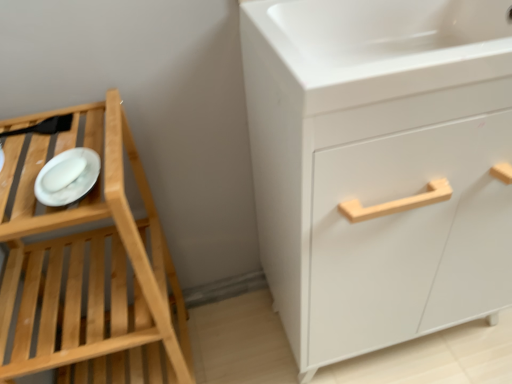
Question: Is white matte cabinet at right placed right next to white matte platter at left?

Choices:
 (A) no
 (B) yes

Answer: (A)

Question: From a real-world perspective, does white matte cabinet at right stand above white matte platter at left?

Choices:
 (A) yes
 (B) no

Answer: (B)

Question: Is white matte cabinet at right wider than white matte platter at left?

Choices:
 (A) yes
 (B) no

Answer: (A)

Question: Considering the relative sizes of white matte cabinet at right and white matte platter at left in the image provided, is white matte cabinet at right taller than white matte platter at left?

Choices:
 (A) yes
 (B) no

Answer: (A)

Question: Can you confirm if white matte cabinet at right is smaller than white matte platter at left?

Choices:
 (A) yes
 (B) no

Answer: (B)

Question: Considering their positions, is white matte cabinet at right located in front of or behind white matte platter at left?

Choices:
 (A) front
 (B) behind

Answer: (A)

Question: Visually, is white matte cabinet at right positioned to the left or to the right of white matte platter at left?

Choices:
 (A) left
 (B) right

Answer: (B)

Question: From the image's perspective, relative to white matte platter at left, is white matte cabinet at right above or below?

Choices:
 (A) below
 (B) above

Answer: (A)

Question: From their relative heights in the image, would you say white matte cabinet at right is taller or shorter than white matte platter at left?

Choices:
 (A) short
 (B) tall

Answer: (B)

Question: From a real-world perspective, is white matte cabinet at right above or below white glossy sink at upper right?

Choices:
 (A) below
 (B) above

Answer: (A)

Question: From the image's perspective, is white matte cabinet at right located above or below white glossy sink at upper right?

Choices:
 (A) above
 (B) below

Answer: (B)

Question: Considering the positions of point (445, 203) and point (430, 6), is point (445, 203) closer or farther from the camera than point (430, 6)?

Choices:
 (A) farther
 (B) closer

Answer: (B)

Question: Considering their positions, is white matte cabinet at right located in front of or behind white glossy sink at upper right?

Choices:
 (A) front
 (B) behind

Answer: (A)

Question: Is white matte platter at left bigger or smaller than white glossy sink at upper right?

Choices:
 (A) big
 (B) small

Answer: (B)

Question: From their relative heights in the image, would you say white matte platter at left is taller or shorter than white glossy sink at upper right?

Choices:
 (A) tall
 (B) short

Answer: (B)